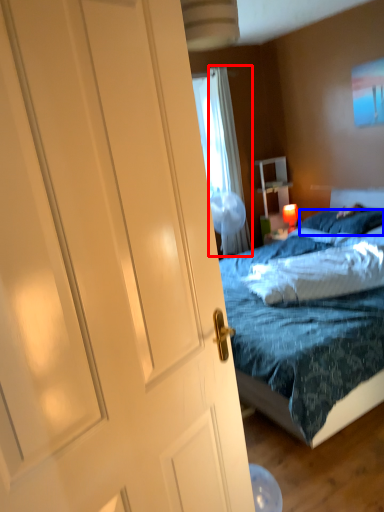
Question: Among these objects, which one is farthest to the camera, curtain (highlighted by a red box) or pillow (highlighted by a blue box)?

Choices:
 (A) curtain
 (B) pillow

Answer: (A)